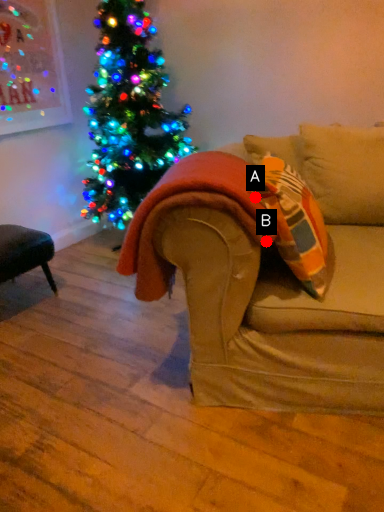
Question: Two points are circled on the image, labeled by A and B beside each circle. Which point is closer to the camera?

Choices:
 (A) A is closer
 (B) B is closer

Answer: (A)